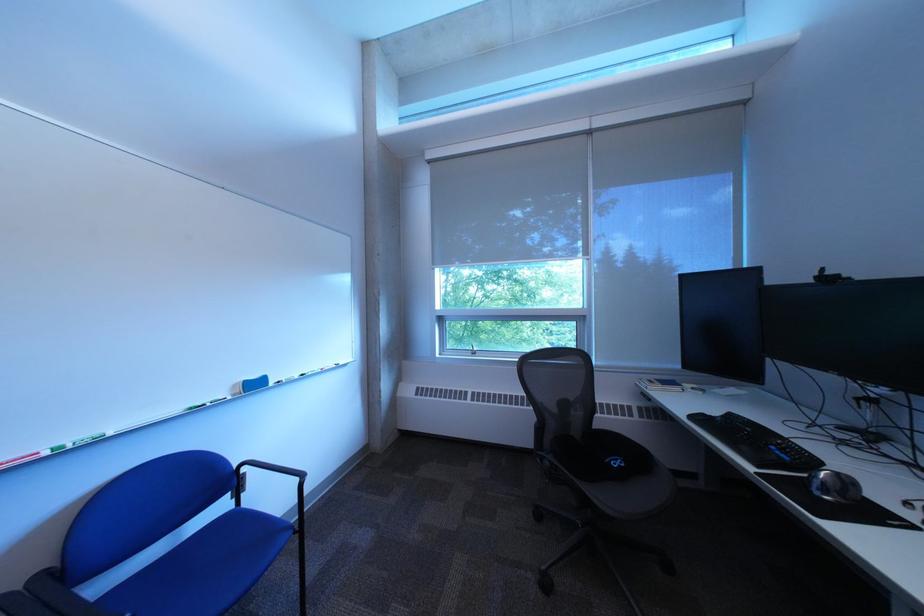
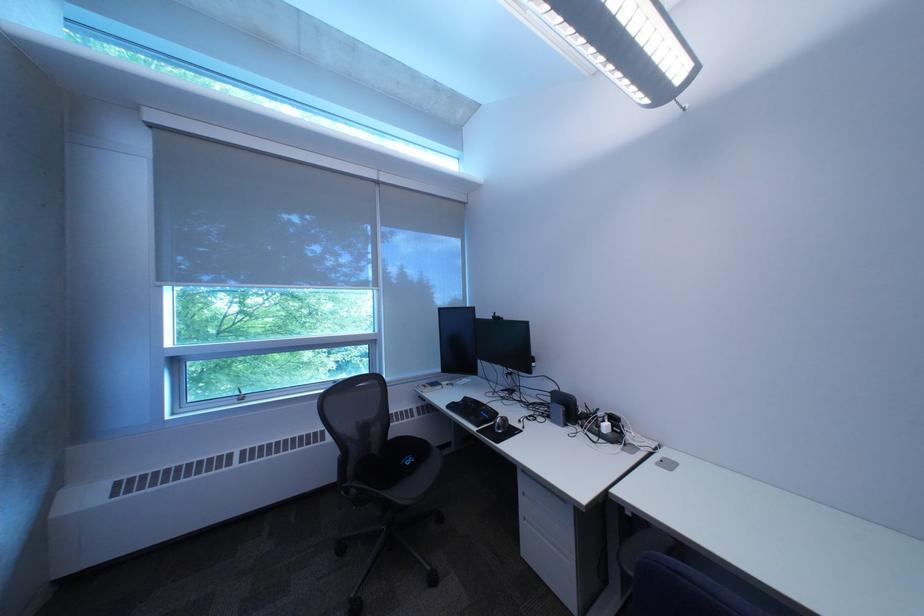
In the second image, find the point that corresponds to [631,462] in the first image.

(423, 461)